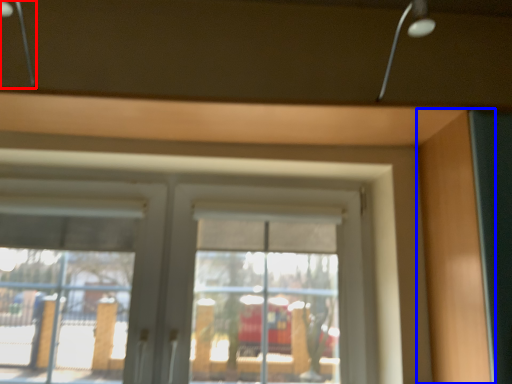
Question: Which object is further to the camera taking this photo, lamp (highlighted by a red box) or garage door (highlighted by a blue box)?

Choices:
 (A) lamp
 (B) garage door

Answer: (B)